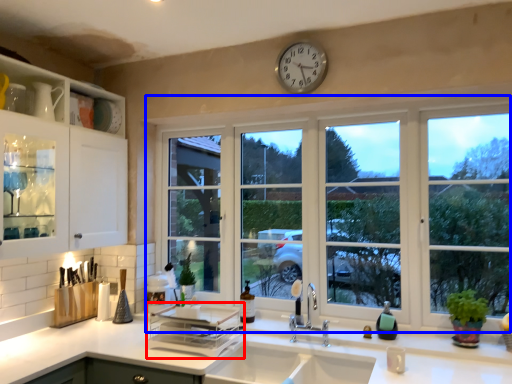
Question: Among these objects, which one is nearest to the camera, appliance (highlighted by a red box) or window (highlighted by a blue box)?

Choices:
 (A) appliance
 (B) window

Answer: (A)